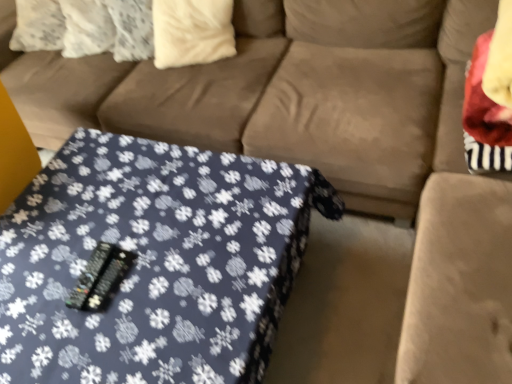
At what (x,y) coordinates should I click in order to perform the action: click on free location above blue fabric table at center (from a real-world perspective). Please return your answer as a coordinate pair (x, y). The width and height of the screenshot is (512, 384). Looking at the image, I should click on (136, 241).